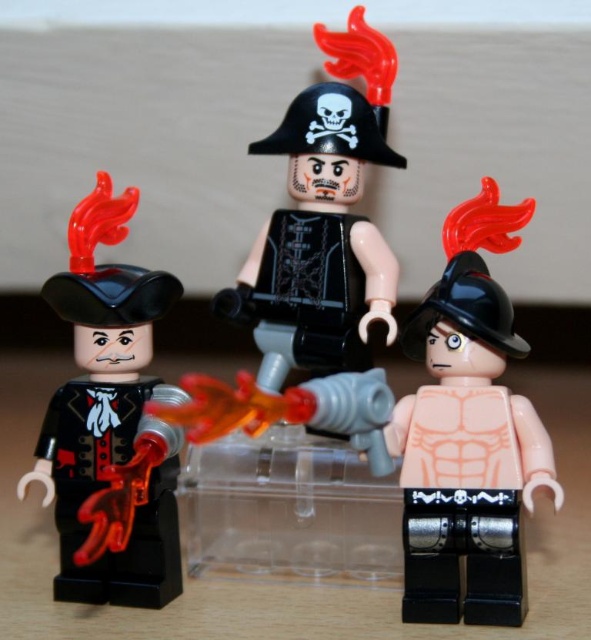
Question: Among these points, which one is farthest from the camera?

Choices:
 (A) (129, 198)
 (B) (245, 320)
 (C) (514, 228)

Answer: (B)

Question: Is matte black torso at center to the left of matte black pirate hat at left from the viewer's perspective?

Choices:
 (A) yes
 (B) no

Answer: (B)

Question: Which object is positioned closest to the matte black pirate hat at center?

Choices:
 (A) matte black torso at center
 (B) matte black pirate hat at left

Answer: (A)

Question: Does matte black pirate hat at left appear on the right side of matte black pirate hat at center?

Choices:
 (A) no
 (B) yes

Answer: (A)

Question: Is matte black torso at center to the right of matte black pirate hat at left from the viewer's perspective?

Choices:
 (A) yes
 (B) no

Answer: (A)

Question: Which point appears closest to the camera in this image?

Choices:
 (A) (365, 220)
 (B) (119, 381)
 (C) (504, 544)

Answer: (C)